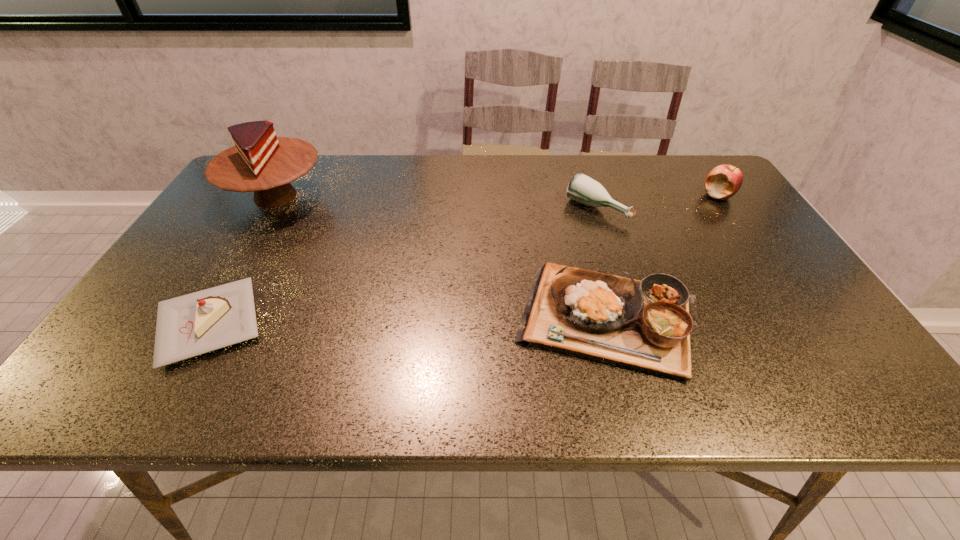
The image size is (960, 540). Find the location of `vacant area situated on the back of the bottle`. vacant area situated on the back of the bottle is located at coordinates click(585, 172).

Image resolution: width=960 pixels, height=540 pixels. I want to click on free space located 0.390m on the back of the platter, so click(572, 184).

Where is `free spot located 0.380m on the right of the nearer cake`? This screenshot has width=960, height=540. free spot located 0.380m on the right of the nearer cake is located at coordinates (438, 323).

Find the location of a particular element. The width and height of the screenshot is (960, 540). cake that is at the far edge is located at coordinates (260, 161).

Where is `apple that is at the far edge`? This screenshot has width=960, height=540. apple that is at the far edge is located at coordinates (724, 181).

At what (x,y) coordinates should I click in order to perform the action: click on bottle that is at the far edge. Please return your answer as a coordinate pair (x, y). Image resolution: width=960 pixels, height=540 pixels. Looking at the image, I should click on (582, 188).

You are a GUI agent. You are given a task and a screenshot of the screen. Output one action in this format:
    pyautogui.click(x=<x>, y=<y>)
    Task: Click on the platter that is at the near edge
    
    Given the screenshot: What is the action you would take?
    tap(646, 325)

Identify the location of cake at the near edge. This screenshot has height=540, width=960. 190,325.

Find the location of a particular element. This screenshot has width=960, height=540. object present at the right edge is located at coordinates (724, 181).

Where is `object situated at the far left corner`? Image resolution: width=960 pixels, height=540 pixels. object situated at the far left corner is located at coordinates (260, 161).